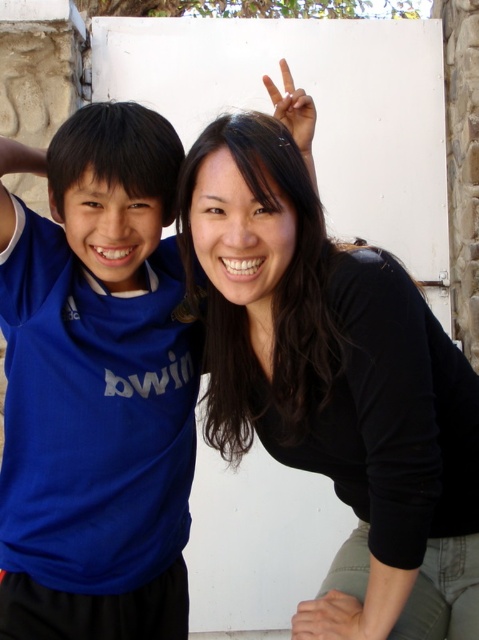
You are a photographer trying to focus on the blue fabric shirt at left. What are the coordinates where you should aim your camera?

The blue fabric shirt at left is located at coordinates point (98, 388). Aim your camera there.

Consider the image. You are designing a layout for a magazine cover and need to place two images side by side. The first image is of the blue fabric shirt at left, and the second is of the black matte shirt at center. Based on their sizes in the original photo, which shirt should be placed first to maintain visual balance?

The blue fabric shirt at left should be placed first because it occupies less space than the black matte shirt at center, so placing the smaller image first helps balance the layout.

You are a photographer adjusting the camera settings. You notice the blue fabric shirt at left and the white matte hand at upper center in your frame. Which object is wider in the image?

The blue fabric shirt at left is wider than the white matte hand at upper center according to the description.